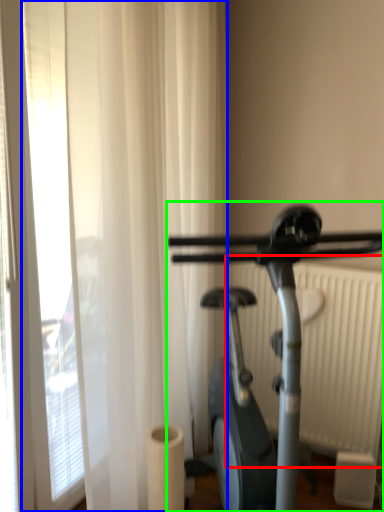
Question: Which object is positioned closest to radiator (highlighted by a red box)? Select from shower curtain (highlighted by a blue box) and stationary bicycle (highlighted by a green box).

Choices:
 (A) shower curtain
 (B) stationary bicycle

Answer: (A)